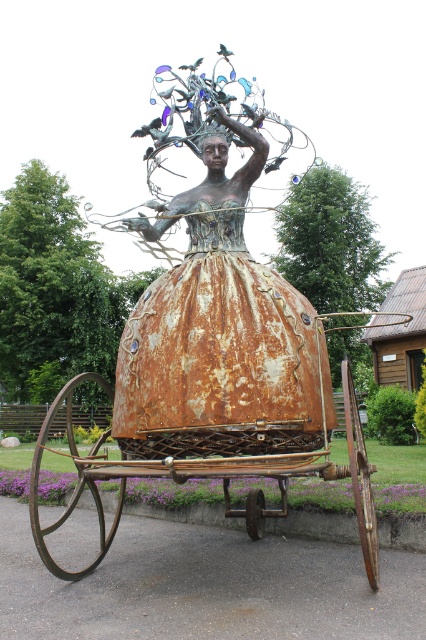
You are a visitor at the park and want to take a photo of both the rusty metal sculpture at center and the rusty metal wagon at center. If you stand to the right of the wagon, will the sculpture be on your left or right side in the photo?

The rusty metal sculpture at center is to the left of the rusty metal wagon at center. If you stand to the right of the wagon, the sculpture will be on your left side in the photo.

You are a park visitor who wants to take a photo of the rusty metal wagon at center without the rusty metal sculpture at center blocking the view. Is there a way to position yourself so that the sculpture is not in front of the wagon?

The rusty metal sculpture at center is above the rusty metal wagon at center. Therefore, you can position yourself directly underneath the sculpture so that the wagon is visible without the sculpture blocking the view.

You are an artist planning to photograph both the rusty metal sculpture at center and the rusty metal wagon at center from a position where both are fully visible. Based on their heights, which object should you place closer to the camera to ensure both are fully in frame?

Since the rusty metal sculpture at center is not as tall as the rusty metal wagon at center, you should place the shorter rusty metal sculpture at center closer to the camera to ensure both are fully visible in the frame.